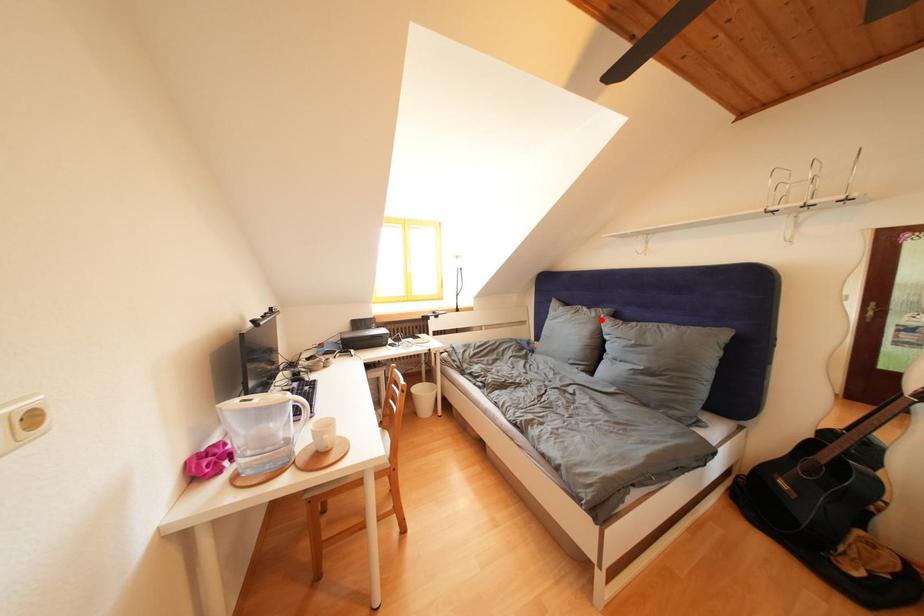
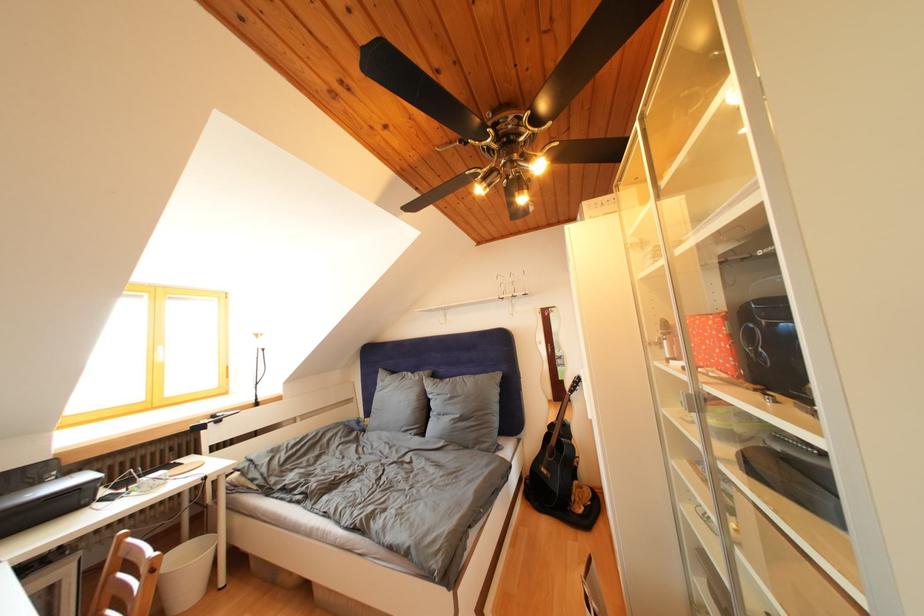
Where in the second image is the point corresponding to the highlighted location from the first image?

(426, 383)